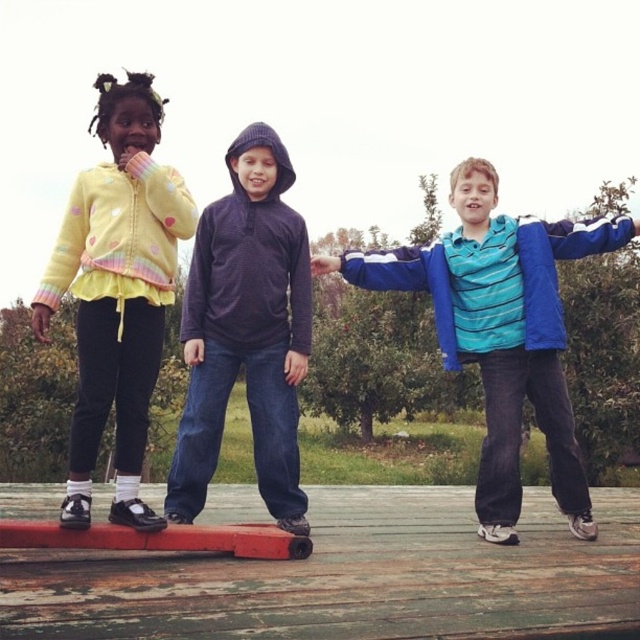
Question: Which of these objects is positioned farthest from the blue striped shirt at center?

Choices:
 (A) yellow fleece jacket at left
 (B) wooden plank at center
 (C) purple fleece hoodie at center

Answer: (A)

Question: Can you confirm if wooden plank at center is positioned above blue striped shirt at center?

Choices:
 (A) no
 (B) yes

Answer: (A)

Question: Observing the image, what is the correct spatial positioning of wooden plank at center in reference to yellow fleece jacket at left?

Choices:
 (A) left
 (B) right

Answer: (B)

Question: Considering the real-world distances, which object is closest to the yellow fleece jacket at left?

Choices:
 (A) blue striped shirt at center
 (B) purple fleece hoodie at center

Answer: (B)

Question: Is wooden plank at center positioned behind blue striped shirt at center?

Choices:
 (A) yes
 (B) no

Answer: (B)

Question: Which object is the farthest from the yellow fleece jacket at left?

Choices:
 (A) purple fleece hoodie at center
 (B) blue striped shirt at center

Answer: (B)